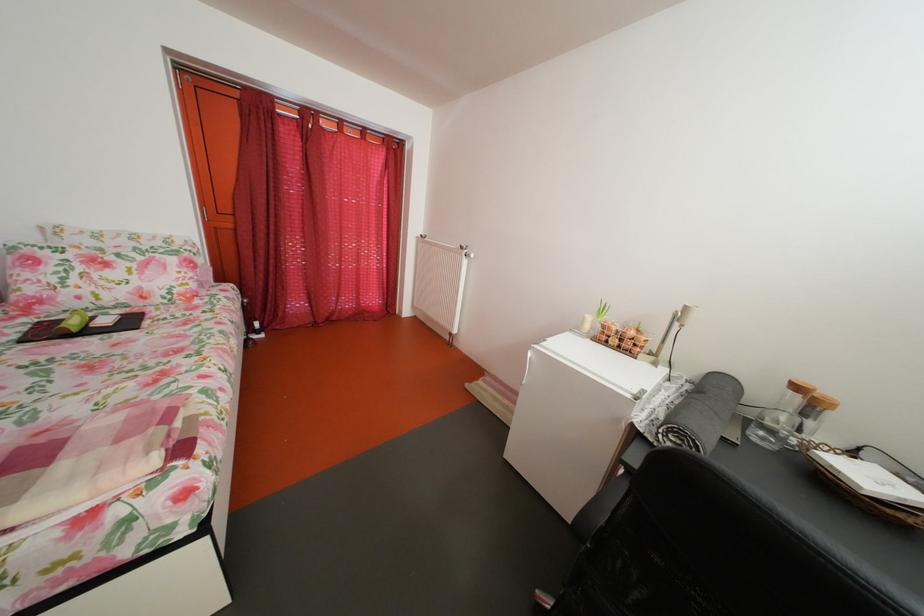
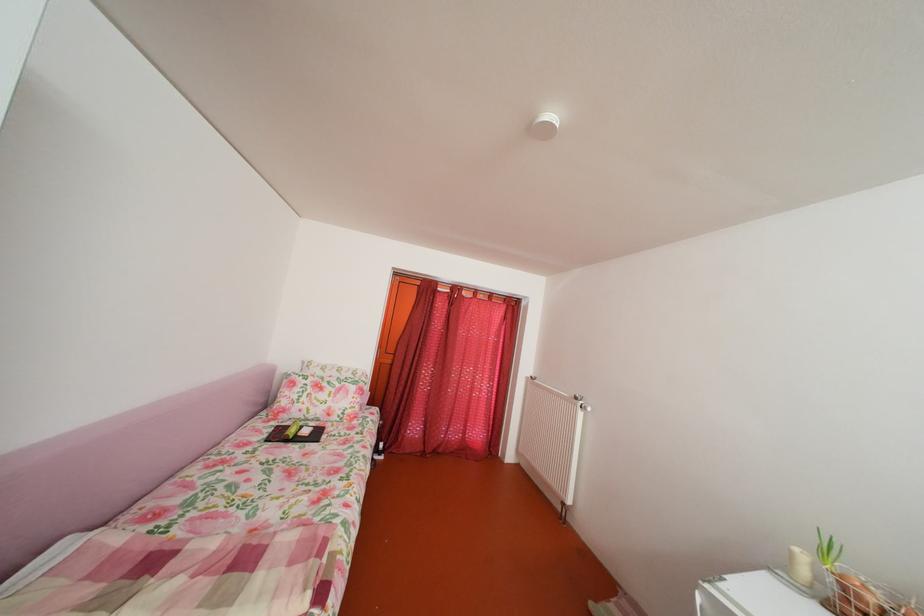
The images are taken continuously from a first-person perspective. In which direction is your viewpoint rotating?

The rotation direction of the camera is left-up.